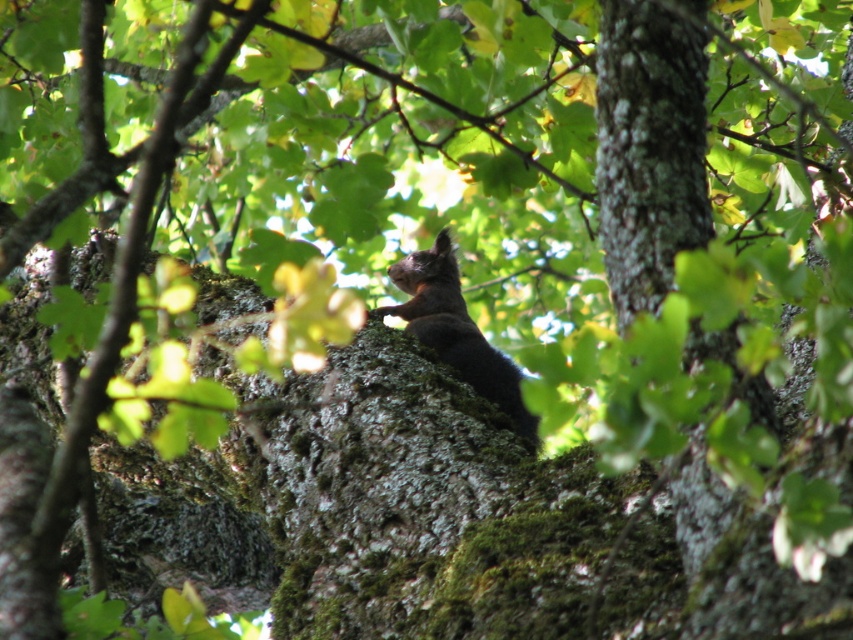
You are a bird flying towards the tree where the green mossy bark at center and shiny brown fur at center are located. Which object will you encounter first as you approach the tree?

The green mossy bark at center is located below the shiny brown fur at center, so you will encounter the shiny brown fur at center first when approaching the tree.

You are a photographer aiming to capture the shiny brown fur at center without the green mossy bark at center obstructing the view. Is this possible given their positions?

The green mossy bark at center is closer to the viewer than the shiny brown fur at center, so the mossy bark would block the direct view of the shiny brown fur at center unless you move your position to avoid the obstruction.

You are a photographer trying to capture the shiny brown fur at center and the green mossy bark at center in a single shot. Based on their positions, which object should you adjust your camera to focus on first if you want to ensure both are in frame?

The green mossy bark at center is to the right of shiny brown fur at center, so you should focus on the shiny brown fur at center first to ensure both are within the frame.